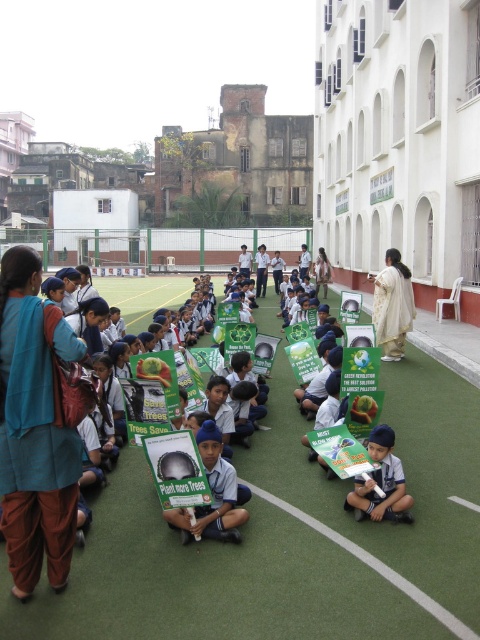
Question: Is white paper at center closer to camera compared to white textured dress at center?

Choices:
 (A) no
 (B) yes

Answer: (B)

Question: Can you confirm if white paper at center is wider than light beige fabric dress at center?

Choices:
 (A) yes
 (B) no

Answer: (A)

Question: Which of these objects is positioned farthest from the white textured dress at center?

Choices:
 (A) white uniform child at center
 (B) blue cotton kurta at center

Answer: (B)

Question: Does blue cotton kurta at center have a smaller size compared to white textured dress at center?

Choices:
 (A) no
 (B) yes

Answer: (A)

Question: Which object appears closest to the camera in this image?

Choices:
 (A) white paper at center
 (B) light beige fabric dress at center

Answer: (A)

Question: Among these points, which one is nearest to the camera?

Choices:
 (A) (206, 474)
 (B) (16, 416)
 (C) (385, 452)

Answer: (B)